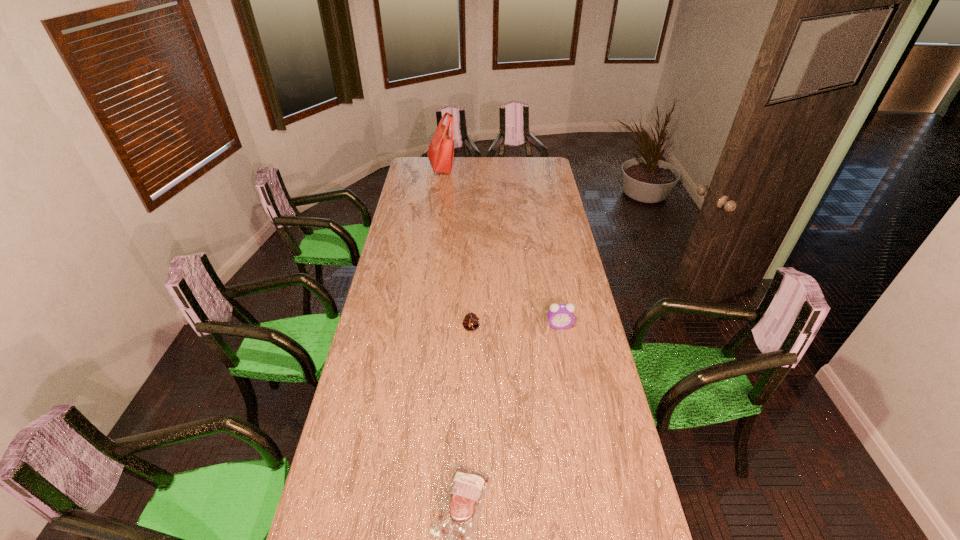
Identify the location of handbag. click(441, 149).

Where is `the farthest object`? This screenshot has width=960, height=540. the farthest object is located at coordinates (441, 149).

Locate an element on the screen. Image resolution: width=960 pixels, height=540 pixels. the third shortest object is located at coordinates (560, 316).

Where is `the rightmost object`? This screenshot has height=540, width=960. the rightmost object is located at coordinates (560, 316).

Find the location of a particular element. This screenshot has width=960, height=540. the second shortest object is located at coordinates (471, 322).

Where is `vacant area located on the front-facing side of the tallest object`? This screenshot has width=960, height=540. vacant area located on the front-facing side of the tallest object is located at coordinates (484, 167).

Locate an element on the screen. The image size is (960, 540). free space located on the face of the alarm clock is located at coordinates (568, 372).

Where is `vacant area situated with a leaf charm attached to the pinecone`? The image size is (960, 540). vacant area situated with a leaf charm attached to the pinecone is located at coordinates (470, 354).

Locate an element on the screen. The width and height of the screenshot is (960, 540). object present at the far edge is located at coordinates (441, 149).

The width and height of the screenshot is (960, 540). I want to click on object situated at the left edge, so (x=441, y=149).